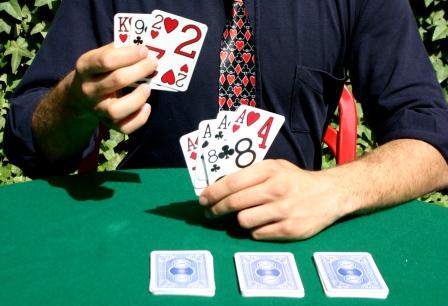
At what (x,y) coordinates should I click in order to perform the action: click on chest. Please return your answer as a coordinate pair (x, y). Looking at the image, I should click on (73, 110).